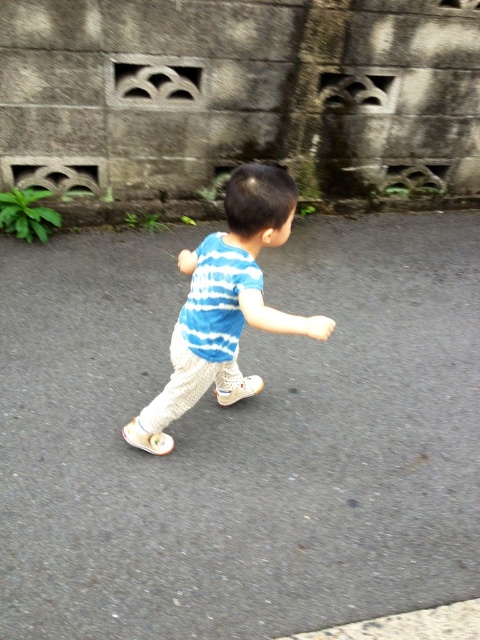
You are a photographer trying to capture the child running along the path. Since the blue striped shirt at center and the gray asphalt pavement at center are both in the scene, which object is closer to the camera?

The gray asphalt pavement at center is closer to the camera because the blue striped shirt at center is behind it.